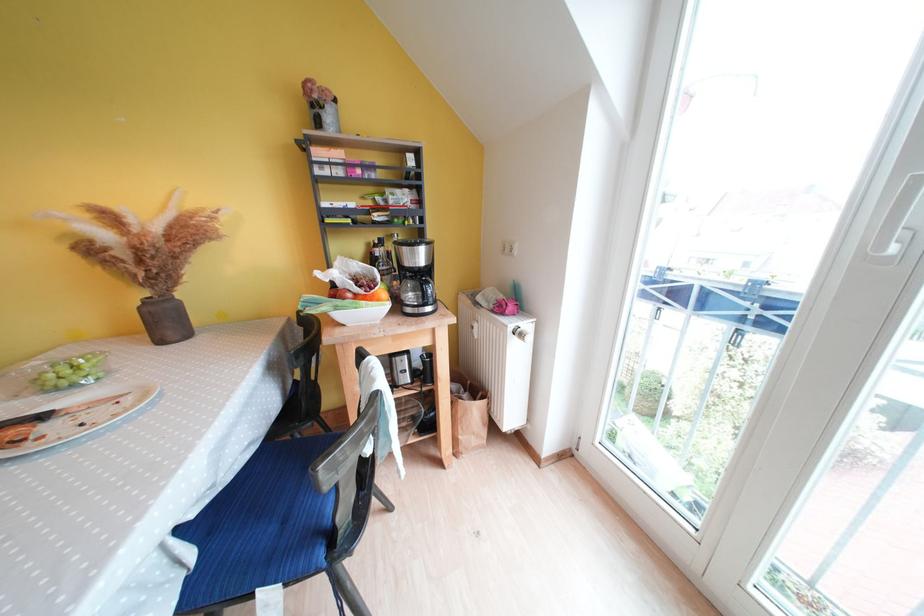
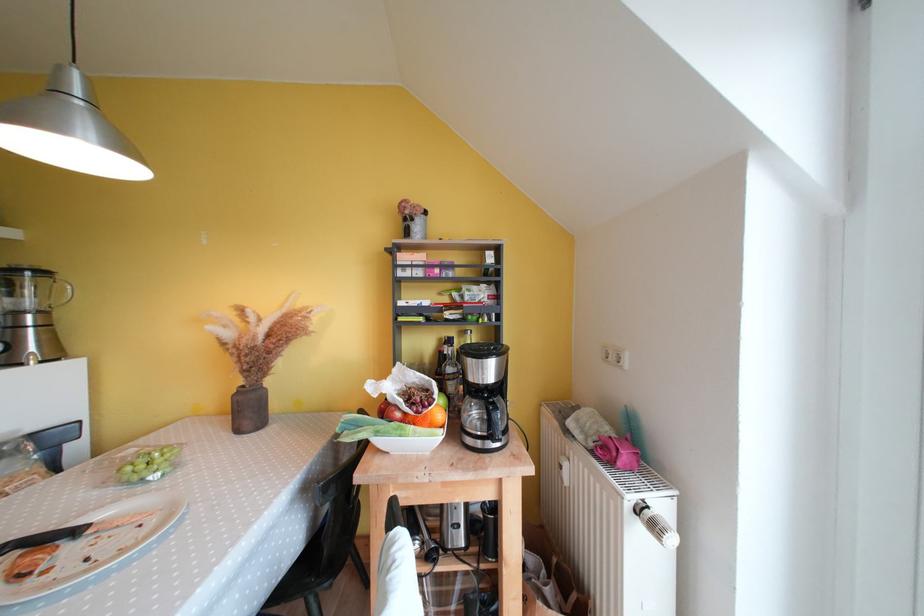
The point at (x=479, y=331) is marked in the first image. Where is the corresponding point in the second image?

(566, 471)